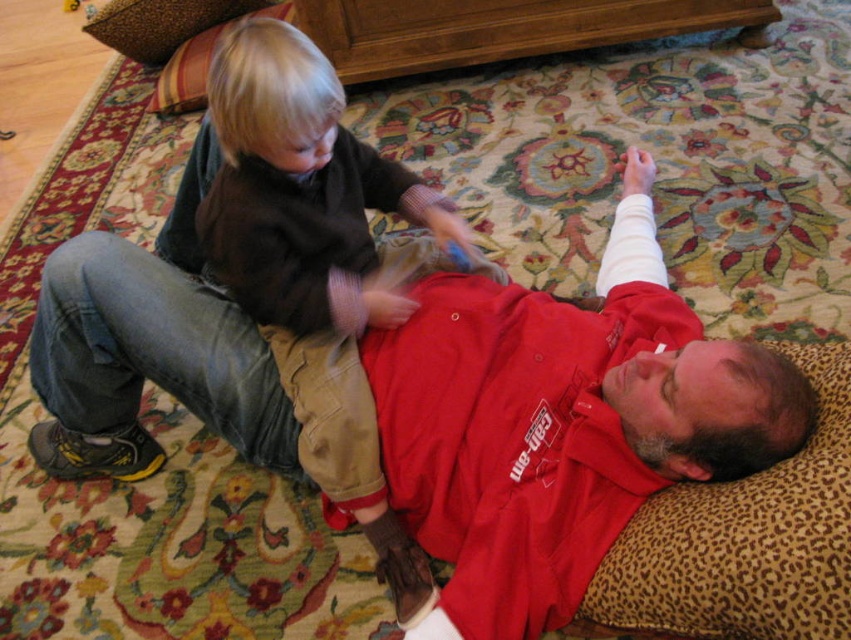
Question: Does red matte jacket at upper center appear on the left side of matte brown sweater at upper left?

Choices:
 (A) no
 (B) yes

Answer: (B)

Question: In this image, where is red matte jacket at upper center located relative to matte brown sweater at upper left?

Choices:
 (A) right
 (B) left

Answer: (B)

Question: Which object is farther from the camera taking this photo?

Choices:
 (A) matte brown sweater at upper left
 (B) red matte jacket at upper center

Answer: (A)

Question: Considering the relative positions of red matte jacket at upper center and matte brown sweater at upper left in the image provided, where is red matte jacket at upper center located with respect to matte brown sweater at upper left?

Choices:
 (A) right
 (B) left

Answer: (B)

Question: Among these objects, which one is farthest from the camera?

Choices:
 (A) matte brown sweater at upper left
 (B) red matte jacket at upper center

Answer: (A)

Question: Which object is farther from the camera taking this photo?

Choices:
 (A) red matte jacket at upper center
 (B) matte brown sweater at upper left

Answer: (B)